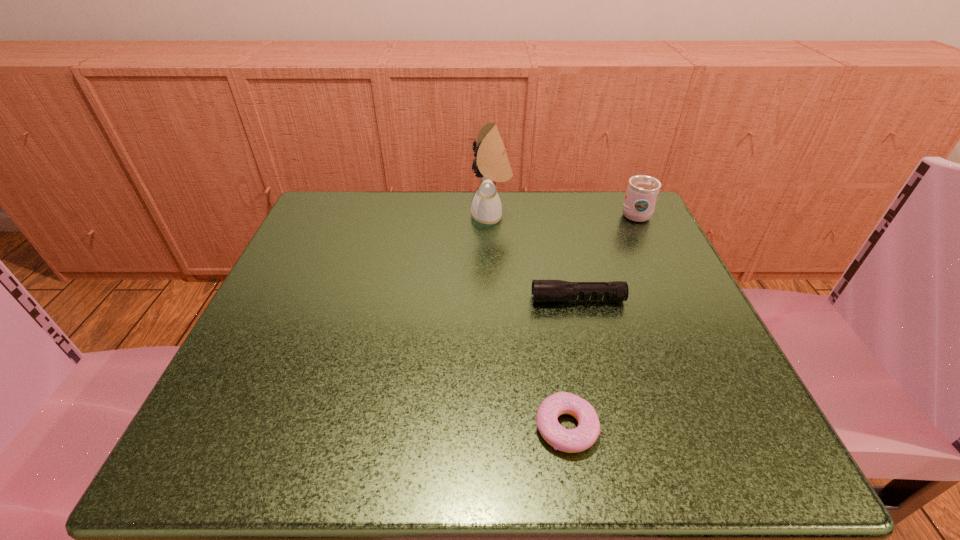
Image resolution: width=960 pixels, height=540 pixels. In order to click on flashlight that is at the right edge in this screenshot , I will do `click(543, 291)`.

This screenshot has width=960, height=540. I want to click on object that is at the far right corner, so click(642, 191).

I want to click on vacant space at the far edge of the desktop, so click(574, 233).

This screenshot has width=960, height=540. I want to click on vacant space at the near edge of the desktop, so coord(618,457).

You are a GUI agent. You are given a task and a screenshot of the screen. Output one action in this format:
    pyautogui.click(x=<x>, y=<y>)
    Task: Click on the blank area at the left edge
    
    Given the screenshot: What is the action you would take?
    pyautogui.click(x=320, y=319)

In the image, there is a desktop. Identify the location of vacant space at the right edge. [704, 361].

Locate an element on the screen. The image size is (960, 540). blank space at the far left corner is located at coordinates (322, 221).

Where is `free space at the near left corner of the desktop`? free space at the near left corner of the desktop is located at coordinates (231, 451).

Locate an element on the screen. The width and height of the screenshot is (960, 540). vacant space at the far right corner is located at coordinates (592, 219).

Image resolution: width=960 pixels, height=540 pixels. In the image, there is a desktop. Find the location of `free space at the near right corner`. free space at the near right corner is located at coordinates (727, 465).